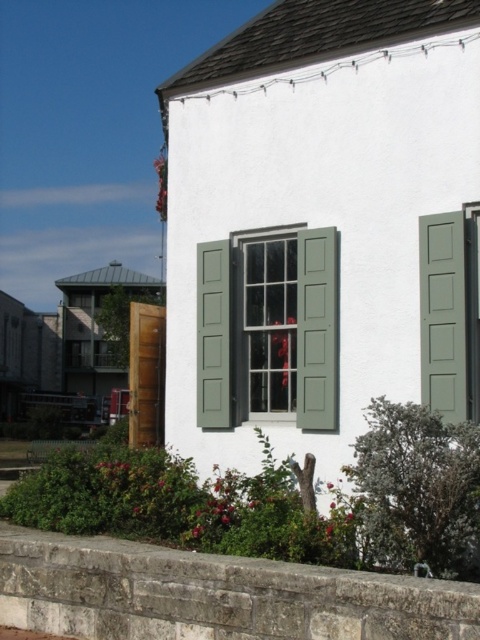
Question: Which point appears closest to the camera in this image?

Choices:
 (A) (207, 276)
 (B) (3, 624)

Answer: (B)

Question: Is gray stone curb at lower left bigger than green matte window at center?

Choices:
 (A) yes
 (B) no

Answer: (A)

Question: Which object is farther from the camera taking this photo?

Choices:
 (A) gray stone curb at lower left
 (B) green matte window at center

Answer: (B)

Question: Does gray stone curb at lower left have a greater width compared to green matte window at center?

Choices:
 (A) no
 (B) yes

Answer: (B)

Question: Is gray stone curb at lower left behind green matte window at center?

Choices:
 (A) yes
 (B) no

Answer: (B)